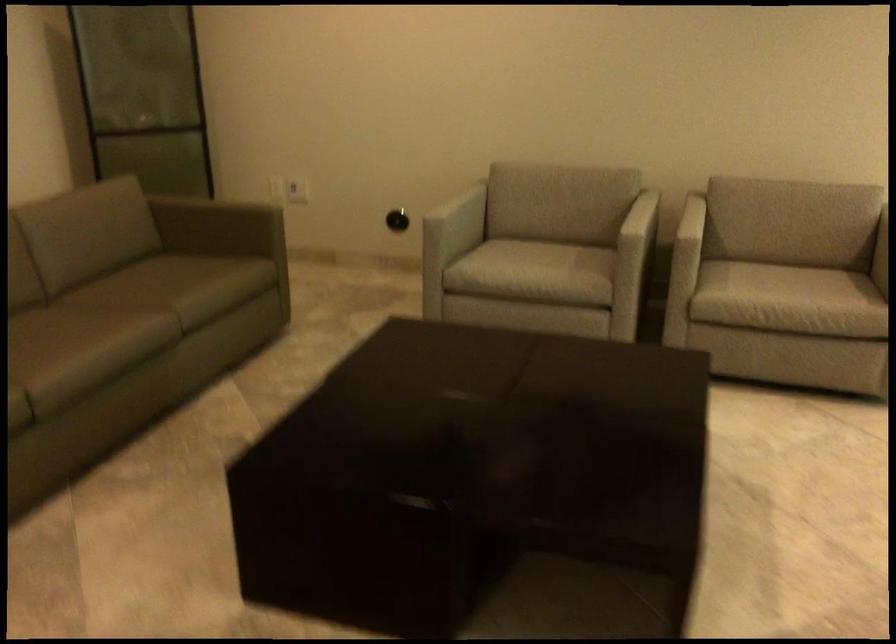
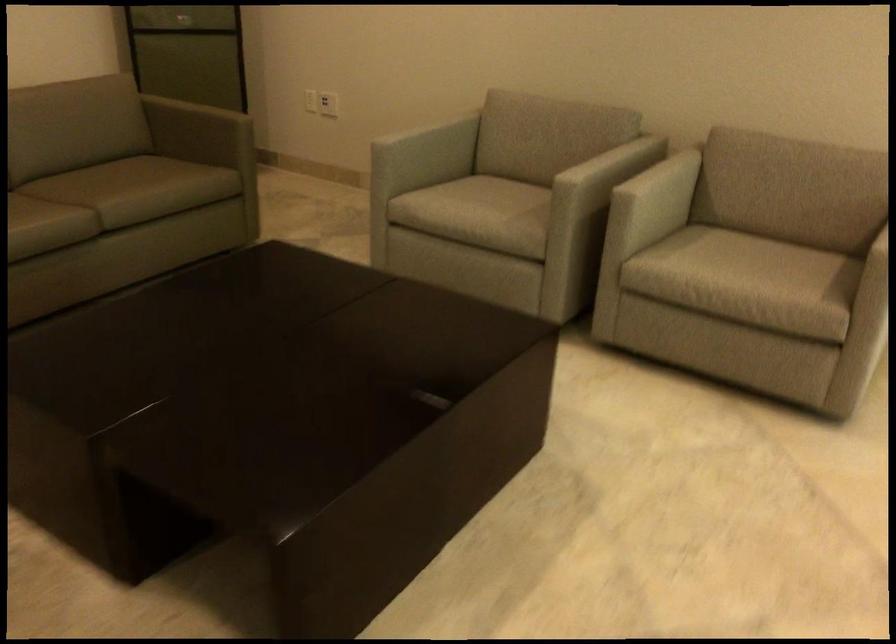
Where in the second image is the point corresponding to point 602,200 from the first image?

(588, 149)